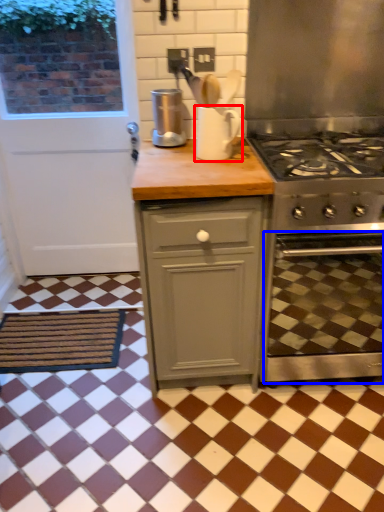
Question: Which point is further to the camera, appliance (highlighted by a red box) or oven (highlighted by a blue box)?

Choices:
 (A) appliance
 (B) oven

Answer: (A)